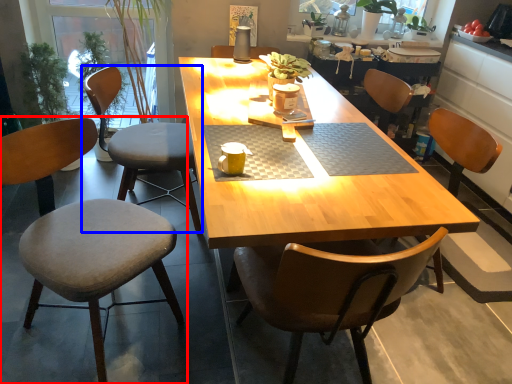
Question: Which of the following is the farthest to the observer, chair (highlighted by a red box) or chair (highlighted by a blue box)?

Choices:
 (A) chair
 (B) chair

Answer: (B)